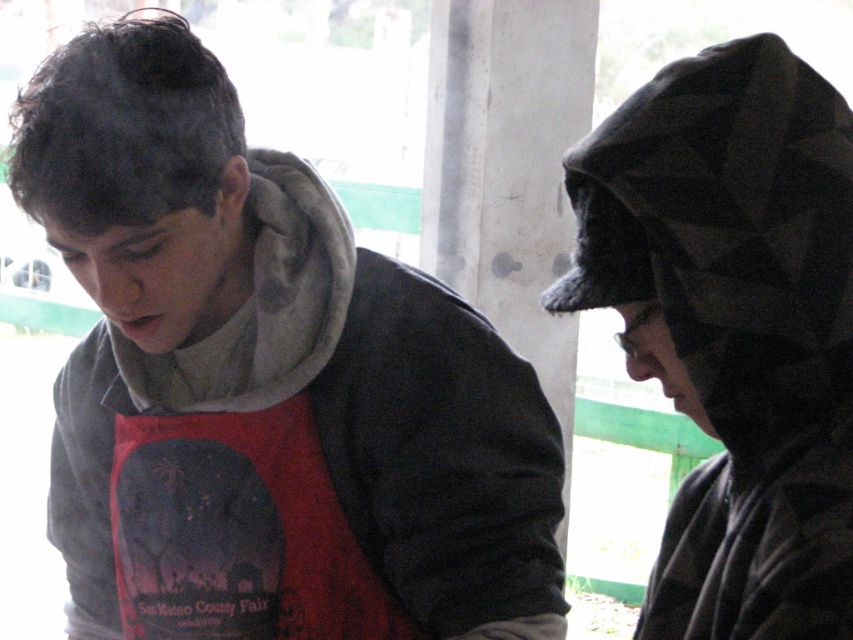
You are a photographer trying to capture both the matte gray hoodie at center and the camouflage fabric hood at right in a single shot. Based on their positions, which one should you focus on first to ensure they are both in frame?

The matte gray hoodie at center is taller than the camouflage fabric hood at right, so you should focus on the matte gray hoodie at center first to ensure both are in frame.